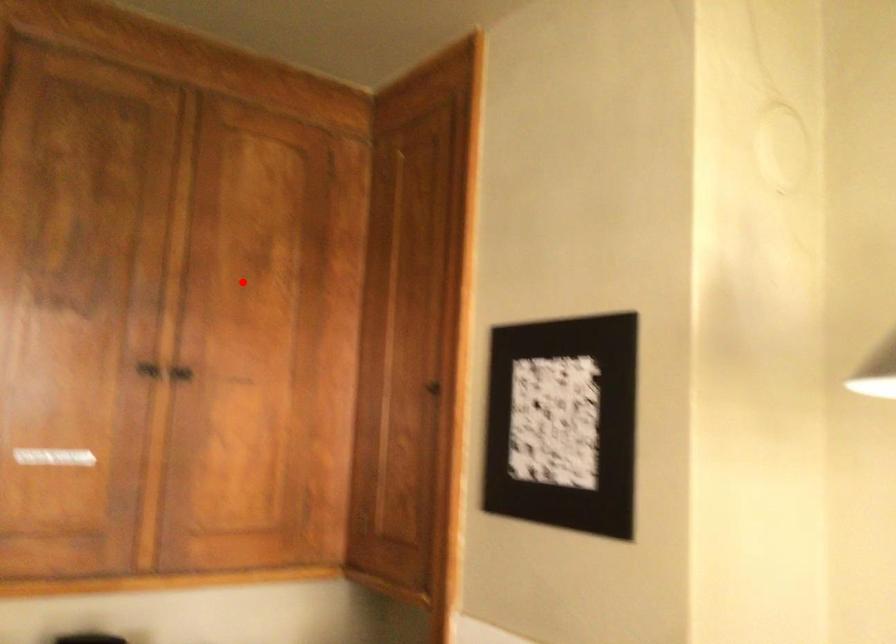
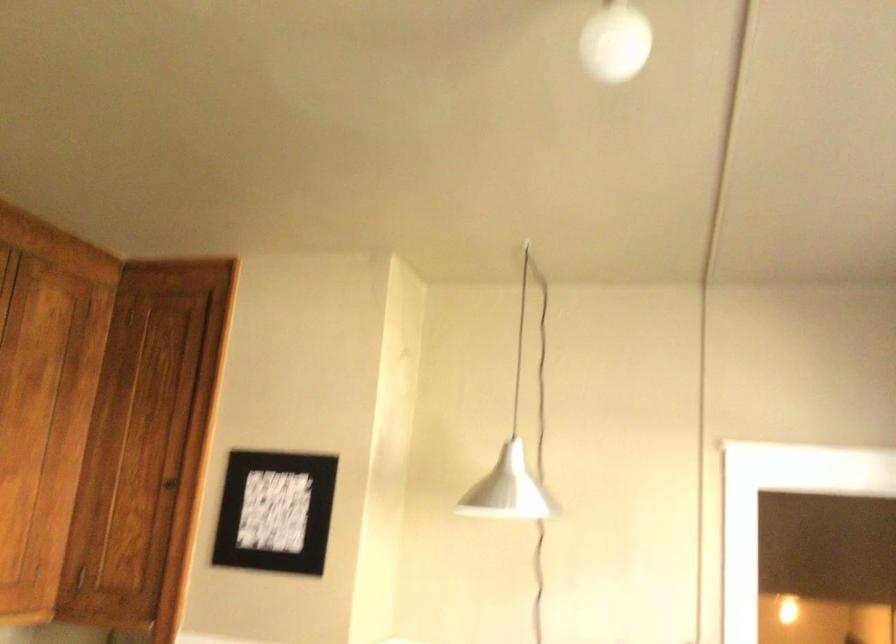
Locate, in the second image, the point that corresponds to the highlighted location in the first image.

(23, 397)